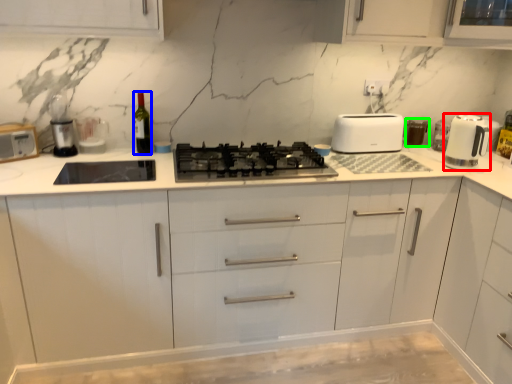
Question: Which object is the farthest from home appliance (highlighted by a red box)? Choose among these: wine bottle (highlighted by a blue box) or appliance (highlighted by a green box).

Choices:
 (A) wine bottle
 (B) appliance

Answer: (A)